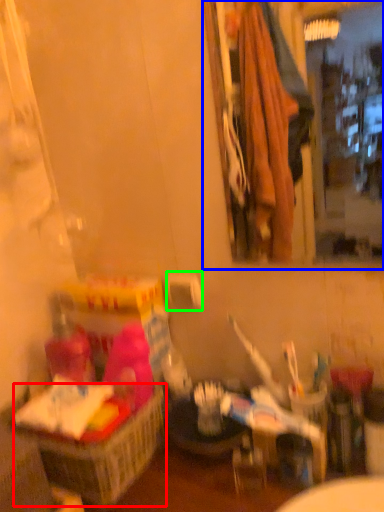
Question: Which is nearer to the basket (highlighted by a red box)? mirror (highlighted by a blue box) or toilet paper (highlighted by a green box).

Choices:
 (A) mirror
 (B) toilet paper

Answer: (B)